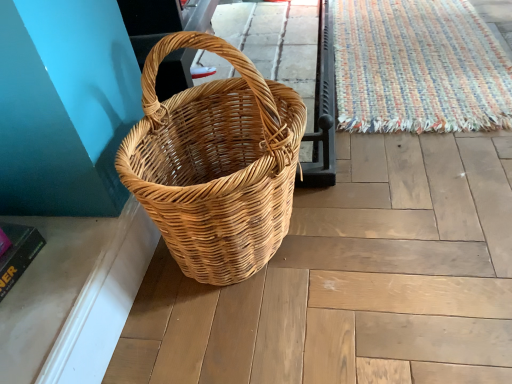
Identify the location of vacant space underneath woven multicolored mat at upper right (from a real-world perspective). The height and width of the screenshot is (384, 512). [423, 64].